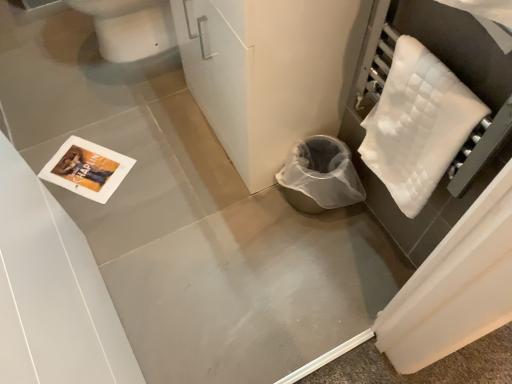
What is the approximate width of white glossy toilet bowl at upper left?

white glossy toilet bowl at upper left is 50.10 centimeters wide.

The image size is (512, 384). What do you see at coordinates (129, 27) in the screenshot?
I see `white glossy toilet bowl at upper left` at bounding box center [129, 27].

This screenshot has width=512, height=384. I want to click on white glossy toilet bowl at upper left, so click(129, 27).

Measure the distance between white quilted towel at right and camera.

white quilted towel at right and camera are 31.79 inches apart from each other.

What do you see at coordinates (417, 125) in the screenshot? Image resolution: width=512 pixels, height=384 pixels. I see `white quilted towel at right` at bounding box center [417, 125].

Locate an element on the screen. white quilted towel at right is located at coordinates (417, 125).

Measure the distance between point (437, 161) and camera.

The distance of point (437, 161) from camera is 36.02 inches.

The image size is (512, 384). I want to click on white glossy toilet bowl at upper left, so click(x=129, y=27).

Is white quilted towel at right to the right of white glossy toilet bowl at upper left from the viewer's perspective?

Yes.

Is white quilted towel at right in front of or behind white glossy toilet bowl at upper left in the image?

Visually, white quilted towel at right is located in front of white glossy toilet bowl at upper left.

Is point (370, 151) positioned behind point (104, 49)?

That is False.

Based on the photo, from the image's perspective, which one is positioned lower, white quilted towel at right or white glossy toilet bowl at upper left?

white quilted towel at right.

From a real-world perspective, is white quilted towel at right physically above white glossy toilet bowl at upper left?

Indeed, from a real-world perspective, white quilted towel at right stands above white glossy toilet bowl at upper left.

Which of these two, white quilted towel at right or white glossy toilet bowl at upper left, is wider?

Wider between the two is white glossy toilet bowl at upper left.

Is white quilted towel at right taller or shorter than white glossy toilet bowl at upper left?

Considering their sizes, white quilted towel at right has less height than white glossy toilet bowl at upper left.

Which of these two, white quilted towel at right or white glossy toilet bowl at upper left, is smaller?

white quilted towel at right.

Is white quilted towel at right completely or partially outside of white glossy toilet bowl at upper left?

Yes.

Would you consider white quilted towel at right to be distant from white glossy toilet bowl at upper left?

Absolutely, white quilted towel at right is distant from white glossy toilet bowl at upper left.

Could you tell me if white quilted towel at right is facing white glossy toilet bowl at upper left?

No, white quilted towel at right is not facing towards white glossy toilet bowl at upper left.

Locate an element on the screen. The width and height of the screenshot is (512, 384). cloth above the white glossy toilet bowl at upper left (from a real-world perspective) is located at coordinates (417, 125).

Which object is positioned more to the right, white glossy toilet bowl at upper left or white quilted towel at right?

Positioned to the right is white quilted towel at right.

In the image, is white glossy toilet bowl at upper left positioned in front of or behind white quilted towel at right?

white glossy toilet bowl at upper left is positioned farther from the viewer than white quilted towel at right.

Which is less distant, (x=128, y=27) or (x=378, y=121)?

Clearly, point (x=128, y=27) is more distant from the camera than point (x=378, y=121).

From the image's perspective, which one is positioned higher, white glossy toilet bowl at upper left or white quilted towel at right?

white glossy toilet bowl at upper left appears higher in the image.

From a real-world perspective, which object rests below the other?

From a 3D spatial view, white glossy toilet bowl at upper left is below.

Which of these two, white glossy toilet bowl at upper left or white quilted towel at right, is thinner?

white quilted towel at right is thinner.

Considering the sizes of white glossy toilet bowl at upper left and white quilted towel at right in the image, is white glossy toilet bowl at upper left taller or shorter than white quilted towel at right?

Considering their sizes, white glossy toilet bowl at upper left has more height than white quilted towel at right.

Is white glossy toilet bowl at upper left bigger than white quilted towel at right?

Indeed, white glossy toilet bowl at upper left has a larger size compared to white quilted towel at right.

Would you say white glossy toilet bowl at upper left is inside or outside white quilted towel at right?

white glossy toilet bowl at upper left is located beyond the bounds of white quilted towel at right.

Would you say white glossy toilet bowl at upper left is a long distance from white quilted towel at right?

That's right, there is a large distance between white glossy toilet bowl at upper left and white quilted towel at right.

Is white glossy toilet bowl at upper left oriented towards white quilted towel at right?

No.

How many degrees apart are the facing directions of white glossy toilet bowl at upper left and white quilted towel at right?

They differ by 1.08 degrees in their facing directions.

Locate an element on the screen. cloth below the white glossy toilet bowl at upper left (from the image's perspective) is located at coordinates (417, 125).

What are the coordinates of `cloth in front of the white glossy toilet bowl at upper left` in the screenshot? It's located at (417, 125).

The image size is (512, 384). In order to click on cloth below the white glossy toilet bowl at upper left (from the image's perspective) in this screenshot , I will do `click(417, 125)`.